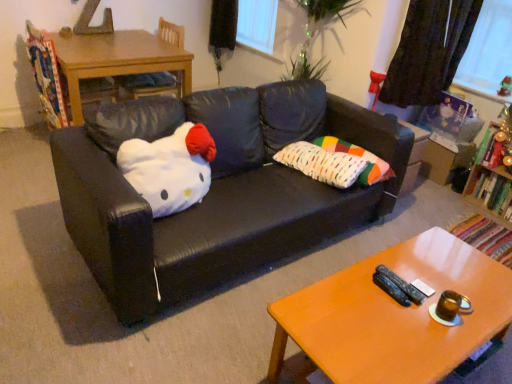
The width and height of the screenshot is (512, 384). What do you see at coordinates (505, 87) in the screenshot?
I see `green matte plush at upper right, which is counted as the 2th toy, starting from the bottom` at bounding box center [505, 87].

What is the approximate width of multicolored fabric pillow at center, placed as the first pillow when sorted from right to left?

The width of multicolored fabric pillow at center, placed as the first pillow when sorted from right to left, is 8.89 inches.

The width and height of the screenshot is (512, 384). What do you see at coordinates (494, 172) in the screenshot?
I see `wooden bookshelf at right` at bounding box center [494, 172].

You are a GUI agent. You are given a task and a screenshot of the screen. Output one action in this format:
    pyautogui.click(x=<x>, y=<y>)
    Task: Click on the orange wood coffee table at lower right
    This screenshot has height=384, width=512.
    Given the screenshot: What is the action you would take?
    pyautogui.click(x=394, y=315)

Where is `white plush at center`? This screenshot has height=384, width=512. white plush at center is located at coordinates (170, 168).

Is dark fabric curtain at upper right at the left side of multicolored fabric pillow at center, positioned as the 2th pillow in left-to-right order?

No.

Considering the positions of objects dark fabric curtain at upper right and multicolored fabric pillow at center, positioned as the 2th pillow in left-to-right order, in the image provided, who is behind, dark fabric curtain at upper right or multicolored fabric pillow at center, positioned as the 2th pillow in left-to-right order,?

dark fabric curtain at upper right is further from the camera.

Is point (380, 98) closer to viewer compared to point (390, 169)?

No, (380, 98) is behind (390, 169).

Is multicolored fabric pillow at center, positioned as the 2th pillow in left-to-right order, far away from dark fabric curtain at upper right?

No, multicolored fabric pillow at center, positioned as the 2th pillow in left-to-right order, is in close proximity to dark fabric curtain at upper right.

Is multicolored fabric pillow at center, placed as the first pillow when sorted from right to left, taller or shorter than dark fabric curtain at upper right?

Clearly, multicolored fabric pillow at center, placed as the first pillow when sorted from right to left, is shorter compared to dark fabric curtain at upper right.

Can you tell me how much multicolored fabric pillow at center, positioned as the 2th pillow in left-to-right order, and dark fabric curtain at upper right differ in facing direction?

The angular difference between multicolored fabric pillow at center, positioned as the 2th pillow in left-to-right order, and dark fabric curtain at upper right is 90.3 degrees.

Who is bigger, multicolored fabric pillow at center, placed as the first pillow when sorted from right to left, or dark fabric curtain at upper right?

dark fabric curtain at upper right is bigger.

Considering the positions of point (293, 318) and point (309, 113), is point (293, 318) closer or farther from the camera than point (309, 113)?

Point (293, 318) appears to be closer to the viewer than point (309, 113).

In the scene shown: Is orange wood coffee table at lower right taller or shorter than black leather couch at center?

orange wood coffee table at lower right is shorter than black leather couch at center.

Find the location of a particular element. studio couch on the left of orange wood coffee table at lower right is located at coordinates [x=217, y=190].

From a real-world perspective, is orange wood coffee table at lower right above or below black leather couch at center?

Clearly, from a real-world perspective, orange wood coffee table at lower right is below black leather couch at center.

Considering the sizes of objects green matte plush at upper right, which ranks as the 1th toy in top-to-bottom order, and orange wood coffee table at lower right in the image provided, who is taller, green matte plush at upper right, which ranks as the 1th toy in top-to-bottom order, or orange wood coffee table at lower right?

Standing taller between the two is orange wood coffee table at lower right.

From the image's perspective, does green matte plush at upper right, which is counted as the 1th toy, starting from the back, appear lower than orange wood coffee table at lower right?

Actually, green matte plush at upper right, which is counted as the 1th toy, starting from the back, appears above orange wood coffee table at lower right in the image.

Relative to orange wood coffee table at lower right, is green matte plush at upper right, which is counted as the 1th toy, starting from the back, in front or behind?

green matte plush at upper right, which is counted as the 1th toy, starting from the back, is positioned farther from the viewer than orange wood coffee table at lower right.

Between green matte plush at upper right, which is counted as the 2th toy, starting from the bottom, and orange wood coffee table at lower right, which one has larger width?

orange wood coffee table at lower right.

Locate an element on the screen. coffee table located below the green matte plush at upper right, which is counted as the 1th toy, starting from the back (from the image's perspective) is located at coordinates (394, 315).

Would you say orange wood coffee table at lower right is a long distance from green matte plush at upper right, which ranks as the 1th toy in top-to-bottom order?

Absolutely, orange wood coffee table at lower right is distant from green matte plush at upper right, which ranks as the 1th toy in top-to-bottom order.

In the scene shown: Can you confirm if orange wood coffee table at lower right is smaller than green matte plush at upper right, the second toy positioned from the front?

No.

Is orange wood coffee table at lower right oriented away from green matte plush at upper right, which is counted as the 2th toy, starting from the bottom?

orange wood coffee table at lower right is not turned away from green matte plush at upper right, which is counted as the 2th toy, starting from the bottom.

Is point (161, 173) more distant than point (385, 323)?

Yes.

From a real-world perspective, is white plush at center positioned above or below orange wood coffee table at lower right?

Clearly, from a real-world perspective, white plush at center is above orange wood coffee table at lower right.

Can you confirm if white plush at center is taller than orange wood coffee table at lower right?

No.

From the picture: Considering the sizes of objects white plush at center and orange wood coffee table at lower right in the image provided, who is smaller, white plush at center or orange wood coffee table at lower right?

white plush at center is smaller.

Is multicolored fabric pillow at center, positioned as the 2th pillow in left-to-right order, directly adjacent to shiny metallic candle at right, marked as the first toy in a front-to-back arrangement?

No, multicolored fabric pillow at center, positioned as the 2th pillow in left-to-right order, is not next to shiny metallic candle at right, marked as the first toy in a front-to-back arrangement.

Can you tell me how much multicolored fabric pillow at center, positioned as the 2th pillow in left-to-right order, and shiny metallic candle at right, the second toy from the back, differ in facing direction?

0.4 degrees.

Is multicolored fabric pillow at center, placed as the first pillow when sorted from right to left, to the right of shiny metallic candle at right, marked as the first toy in a front-to-back arrangement, from the viewer's perspective?

In fact, multicolored fabric pillow at center, placed as the first pillow when sorted from right to left, is to the left of shiny metallic candle at right, marked as the first toy in a front-to-back arrangement.

From the image's perspective, relative to shiny metallic candle at right, which is the second toy from top to bottom, is multicolored fabric pillow at center, positioned as the 2th pillow in left-to-right order, above or below?

multicolored fabric pillow at center, positioned as the 2th pillow in left-to-right order, is situated lower than shiny metallic candle at right, which is the second toy from top to bottom, in the image.

Starting from the dark fabric curtain at upper right, which pillow is the 1st one to the left? Please provide its 2D coordinates.

[(361, 157)]

Image resolution: width=512 pixels, height=384 pixels. In order to click on the 2nd pillow located beneath the dark fabric curtain at upper right (from a real-world perspective) in this screenshot , I will do `click(361, 157)`.

When comparing their distances from wooden bookshelf at right, does black leather couch at center or dark fabric curtain at upper right seem further?

black leather couch at center.

Looking at the image, which one is located closer to orange wood coffee table at lower right, multicolored fabric pillow at center, placed as the first pillow when sorted from right to left, or black leather couch at center?

black leather couch at center.

Considering their positions, is green matte plush at upper right, which is counted as the 2th toy, starting from the bottom, positioned closer to orange wood coffee table at lower right than dark fabric curtain at upper right?

dark fabric curtain at upper right.

When comparing their distances from wooden table at left, does black leather couch at center or dark fabric curtain at upper right seem further?

Among the two, dark fabric curtain at upper right is located further to wooden table at left.

Considering their positions, is multicolored fabric pillow at center, placed as the first pillow when sorted from right to left, positioned further to white plush at center than black leather couch at center?

multicolored fabric pillow at center, placed as the first pillow when sorted from right to left.

Based on their spatial positions, is wooden chair at upper left or multicolored fabric pillow at center, the first pillow from the left, closer to orange wood coffee table at lower right?

multicolored fabric pillow at center, the first pillow from the left.

From the image, which object appears to be nearer to multicolored fabric pillow at center, which appears as the 2th pillow when viewed from the right, black leather couch at center or dark fabric curtain at upper right?

The object closer to multicolored fabric pillow at center, which appears as the 2th pillow when viewed from the right, is black leather couch at center.

Estimate the real-world distances between objects in this image. Which object is further from orange wood coffee table at lower right, black leather couch at center or white plush at center?

white plush at center lies further to orange wood coffee table at lower right than the other object.

This screenshot has height=384, width=512. In order to click on studio couch located between wooden table at left and shiny metallic candle at right, the second toy from the back, in the left-right direction in this screenshot , I will do `click(217, 190)`.

Find the location of a particular element. The image size is (512, 384). studio couch located between white plush at center and shiny metallic candle at right, which ranks as the 1th toy in bottom-to-top order, in the left-right direction is located at coordinates (217, 190).

Locate an element on the screen. The image size is (512, 384). bookshelf between orange wood coffee table at lower right and green matte plush at upper right, which is counted as the 2th toy, starting from the bottom, in the front-back direction is located at coordinates (494, 172).

At what (x,y) coordinates should I click in order to perform the action: click on bookshelf between multicolored fabric pillow at center, which appears as the 2th pillow when viewed from the right, and green matte plush at upper right, which ranks as the 1th toy in top-to-bottom order. Please return your answer as a coordinate pair (x, y). This screenshot has height=384, width=512. Looking at the image, I should click on tap(494, 172).